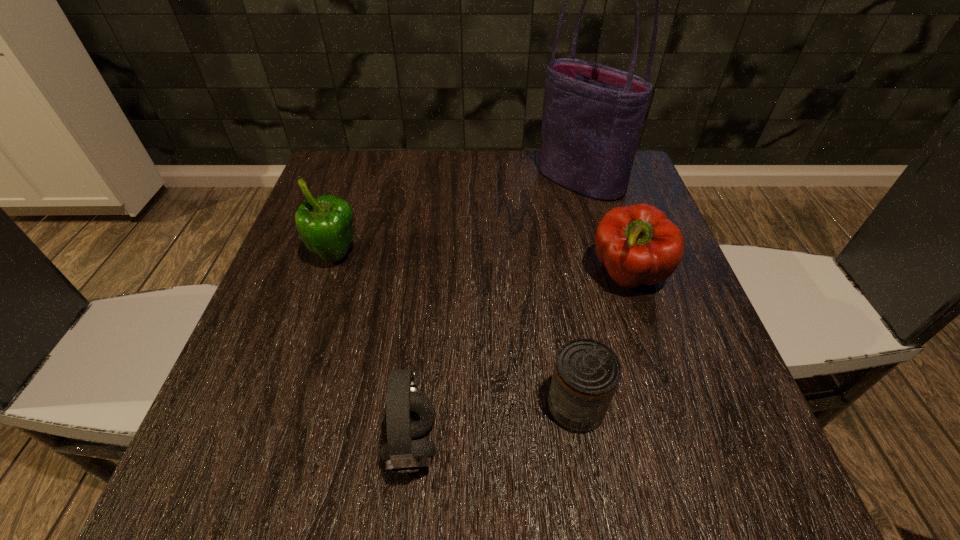
The width and height of the screenshot is (960, 540). In order to click on tote bag in this screenshot , I will do `click(592, 118)`.

Identify the location of the farthest object. This screenshot has width=960, height=540. (592, 118).

Locate an element on the screen. Image resolution: width=960 pixels, height=540 pixels. the left bell pepper is located at coordinates (325, 223).

Locate an element on the screen. the right bell pepper is located at coordinates (638, 245).

Where is `headset`? headset is located at coordinates (408, 413).

At what (x,y) coordinates should I click in order to perform the action: click on the shortest object. Please return your answer as a coordinate pair (x, y). The image size is (960, 540). Looking at the image, I should click on (587, 372).

The image size is (960, 540). Identify the location of free space located 0.260m on the left of the tallest object. (434, 180).

Image resolution: width=960 pixels, height=540 pixels. I want to click on vacant area situated 0.290m on the back of the leftmost object, so click(366, 165).

This screenshot has width=960, height=540. Identify the location of blank area located 0.340m on the back of the right bell pepper. (591, 162).

The height and width of the screenshot is (540, 960). I want to click on vacant space located on the ear cups of the second object from left to right, so click(x=571, y=444).